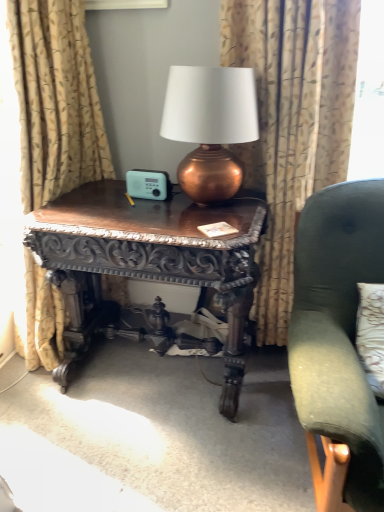
What do you see at coordinates (151, 263) in the screenshot? I see `dark wood carved table at center` at bounding box center [151, 263].

Describe the element at coordinates (338, 330) in the screenshot. I see `velvet green armchair at right` at that location.

You are a GUI agent. You are given a task and a screenshot of the screen. Output one action in this format:
    pyautogui.click(x=<x>, y=<y>)
    Task: Click on the patterned fabric curtain at center, the 1th curtain from the right
    This screenshot has height=512, width=384.
    Given the screenshot: What is the action you would take?
    pyautogui.click(x=292, y=123)

Consider the image. Would you say dark wood carved table at center is to the left or to the right of gold textured curtain at left, positioned as the first curtain in left-to-right order, in the picture?

Clearly, dark wood carved table at center is on the right of gold textured curtain at left, positioned as the first curtain in left-to-right order, in the image.

Considering the relative sizes of dark wood carved table at center and gold textured curtain at left, the 2th curtain in the right-to-left sequence, in the image provided, is dark wood carved table at center bigger than gold textured curtain at left, the 2th curtain in the right-to-left sequence,?

Yes, dark wood carved table at center is bigger than gold textured curtain at left, the 2th curtain in the right-to-left sequence.

Is dark wood carved table at center in front of or behind gold textured curtain at left, the 2th curtain in the right-to-left sequence, in the image?

Visually, dark wood carved table at center is located behind gold textured curtain at left, the 2th curtain in the right-to-left sequence.

Considering the relative positions of copper metallic lamp at center and dark wood carved table at center in the image provided, is copper metallic lamp at center to the right of dark wood carved table at center from the viewer's perspective?

Correct, you'll find copper metallic lamp at center to the right of dark wood carved table at center.

Is point (235, 75) closer or farther from the camera than point (79, 310)?

Point (235, 75) appears to be closer to the viewer than point (79, 310).

Does copper metallic lamp at center turn towards dark wood carved table at center?

No, copper metallic lamp at center is not aimed at dark wood carved table at center.

From the image's perspective, is copper metallic lamp at center positioned above or below dark wood carved table at center?

copper metallic lamp at center is above dark wood carved table at center.

Considering the relative sizes of dark wood carved table at center and patterned fabric curtain at center, the 1th curtain from the right, in the image provided, is dark wood carved table at center wider than patterned fabric curtain at center, the 1th curtain from the right,?

Indeed, dark wood carved table at center has a greater width compared to patterned fabric curtain at center, the 1th curtain from the right.

Considering the relative sizes of dark wood carved table at center and patterned fabric curtain at center, the 1th curtain from the right, in the image provided, is dark wood carved table at center bigger than patterned fabric curtain at center, the 1th curtain from the right,?

Indeed, dark wood carved table at center has a larger size compared to patterned fabric curtain at center, the 1th curtain from the right.

Which is in front, point (57, 247) or point (274, 335)?

The point (57, 247) is closer to the camera.

Between dark wood carved table at center and patterned fabric curtain at center, which is the 2th curtain in left-to-right order, which one is positioned in front?

dark wood carved table at center is more forward.

How many degrees apart are the facing directions of gold textured curtain at left, the 2th curtain in the right-to-left sequence, and dark wood carved table at center?

The angle between the facing direction of gold textured curtain at left, the 2th curtain in the right-to-left sequence, and the facing direction of dark wood carved table at center is 91.2 degrees.

Would you say gold textured curtain at left, positioned as the first curtain in left-to-right order, is inside or outside dark wood carved table at center?

gold textured curtain at left, positioned as the first curtain in left-to-right order, exists outside the volume of dark wood carved table at center.

Does gold textured curtain at left, positioned as the first curtain in left-to-right order, have a lesser height compared to dark wood carved table at center?

Incorrect, the height of gold textured curtain at left, positioned as the first curtain in left-to-right order, does not fall short of that of dark wood carved table at center.

Is point (202, 96) in front of point (40, 142)?

Yes, point (202, 96) is closer to viewer.

In order to click on the 1st curtain below when counting from the copper metallic lamp at center (from the image's perspective) in this screenshot , I will do `click(55, 100)`.

Which is in front, copper metallic lamp at center or gold textured curtain at left, the 2th curtain in the right-to-left sequence?

gold textured curtain at left, the 2th curtain in the right-to-left sequence.

Considering the sizes of objects copper metallic lamp at center and gold textured curtain at left, the 2th curtain in the right-to-left sequence, in the image provided, who is thinner, copper metallic lamp at center or gold textured curtain at left, the 2th curtain in the right-to-left sequence,?

Thinner between the two is gold textured curtain at left, the 2th curtain in the right-to-left sequence.

Would you say gold textured curtain at left, positioned as the first curtain in left-to-right order, is inside or outside copper metallic lamp at center?

The correct answer is: outside.

From a real-world perspective, which curtain is the 2nd one underneath the copper metallic lamp at center? Please provide its 2D coordinates.

[(55, 100)]

Which of these two, gold textured curtain at left, positioned as the first curtain in left-to-right order, or copper metallic lamp at center, stands shorter?

With less height is copper metallic lamp at center.

Is gold textured curtain at left, positioned as the first curtain in left-to-right order, positioned with its back to copper metallic lamp at center?

Correct, gold textured curtain at left, positioned as the first curtain in left-to-right order, is looking away from copper metallic lamp at center.

Identify the location of chair on the right of copper metallic lamp at center. The width and height of the screenshot is (384, 512). (338, 330).

Is copper metallic lamp at center further to the viewer compared to velvet green armchair at right?

Yes.

From a real-world perspective, does copper metallic lamp at center stand above velvet green armchair at right?

Yes.

Would you say velvet green armchair at right is part of copper metallic lamp at center's contents?

No, copper metallic lamp at center does not contain velvet green armchair at right.

Locate an element on the screen. This screenshot has height=512, width=384. table to the right of gold textured curtain at left, positioned as the first curtain in left-to-right order is located at coordinates (151, 263).

The height and width of the screenshot is (512, 384). Find the location of `table that appears on the left of copper metallic lamp at center`. table that appears on the left of copper metallic lamp at center is located at coordinates point(151,263).

Considering their positions, is patterned fabric curtain at center, which is the 2th curtain in left-to-right order, positioned further to copper metallic lamp at center than velvet green armchair at right?

velvet green armchair at right is positioned further to the anchor copper metallic lamp at center.

When comparing their distances from gold textured curtain at left, positioned as the first curtain in left-to-right order, does dark wood carved table at center or copper metallic lamp at center seem closer?

dark wood carved table at center.

Which object lies nearer to the anchor point dark wood carved table at center, patterned fabric curtain at center, which is the 2th curtain in left-to-right order, or velvet green armchair at right?

patterned fabric curtain at center, which is the 2th curtain in left-to-right order, lies closer to dark wood carved table at center than the other object.

When comparing their distances from patterned fabric curtain at center, which is the 2th curtain in left-to-right order, does dark wood carved table at center or gold textured curtain at left, positioned as the first curtain in left-to-right order, seem closer?

Based on the image, dark wood carved table at center appears to be nearer to patterned fabric curtain at center, which is the 2th curtain in left-to-right order.

When comparing their distances from velvet green armchair at right, does gold textured curtain at left, positioned as the first curtain in left-to-right order, or dark wood carved table at center seem further?

gold textured curtain at left, positioned as the first curtain in left-to-right order, lies further to velvet green armchair at right than the other object.

Estimate the real-world distances between objects in this image. Which object is further from velvet green armchair at right, gold textured curtain at left, the 2th curtain in the right-to-left sequence, or copper metallic lamp at center?

gold textured curtain at left, the 2th curtain in the right-to-left sequence, lies further to velvet green armchair at right than the other object.

Based on their spatial positions, is dark wood carved table at center or patterned fabric curtain at center, which is the 2th curtain in left-to-right order, further from velvet green armchair at right?

dark wood carved table at center is positioned further to the anchor velvet green armchair at right.

Based on their spatial positions, is copper metallic lamp at center or patterned fabric curtain at center, which is the 2th curtain in left-to-right order, closer to velvet green armchair at right?

The object closer to velvet green armchair at right is patterned fabric curtain at center, which is the 2th curtain in left-to-right order.

This screenshot has width=384, height=512. Find the location of `table situated between gold textured curtain at left, the 2th curtain in the right-to-left sequence, and patterned fabric curtain at center, the 1th curtain from the right, from left to right`. table situated between gold textured curtain at left, the 2th curtain in the right-to-left sequence, and patterned fabric curtain at center, the 1th curtain from the right, from left to right is located at coordinates (151, 263).

Where is `lamp situated between gold textured curtain at left, positioned as the first curtain in left-to-right order, and patterned fabric curtain at center, which is the 2th curtain in left-to-right order, from left to right`? The height and width of the screenshot is (512, 384). lamp situated between gold textured curtain at left, positioned as the first curtain in left-to-right order, and patterned fabric curtain at center, which is the 2th curtain in left-to-right order, from left to right is located at coordinates (210, 126).

Identify the location of table situated between gold textured curtain at left, positioned as the first curtain in left-to-right order, and copper metallic lamp at center from left to right. 151,263.

Find the location of `curtain between dark wood carved table at center and velvet green armchair at right from left to right`. curtain between dark wood carved table at center and velvet green armchair at right from left to right is located at coordinates (292, 123).